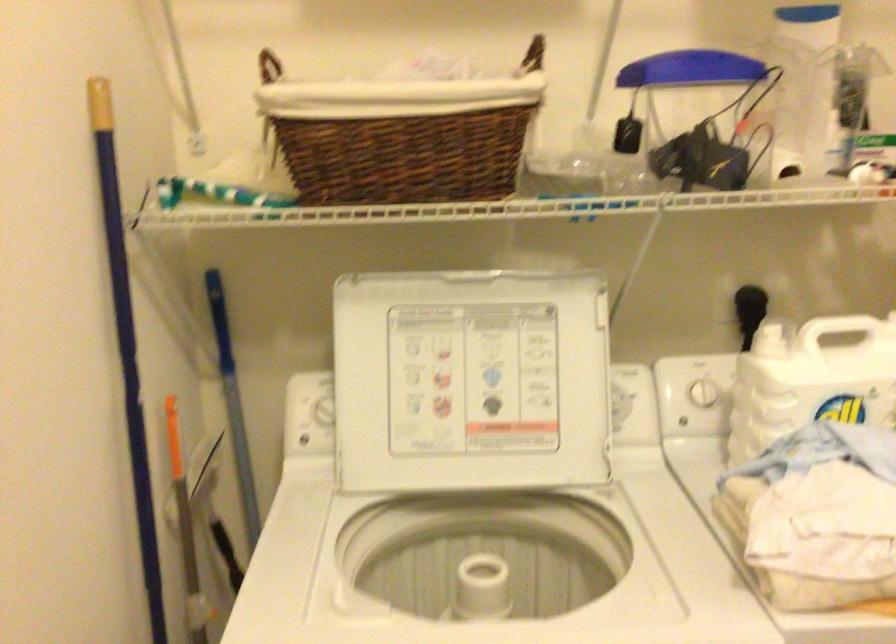
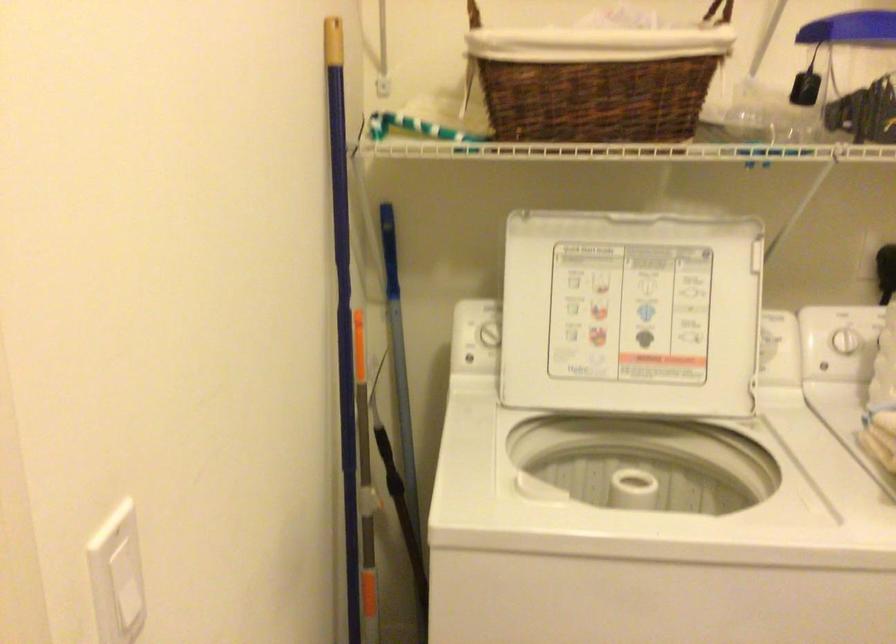
In the second image, find the point that corresponds to point 700,397 in the first image.

(845, 341)